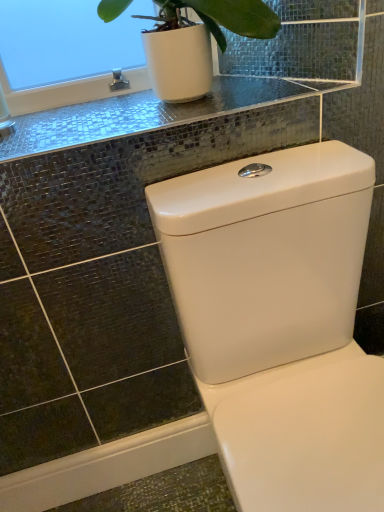
Question: From the image's perspective, would you say white glossy toilet at center is positioned over shiny glass counter top at upper center?

Choices:
 (A) no
 (B) yes

Answer: (A)

Question: Is white glossy toilet at center smaller than shiny glass counter top at upper center?

Choices:
 (A) no
 (B) yes

Answer: (A)

Question: Is white glossy toilet at center looking in the opposite direction of shiny glass counter top at upper center?

Choices:
 (A) no
 (B) yes

Answer: (B)

Question: Can you confirm if white glossy toilet at center is shorter than shiny glass counter top at upper center?

Choices:
 (A) no
 (B) yes

Answer: (A)

Question: Is white glossy toilet at center to the left of shiny glass counter top at upper center from the viewer's perspective?

Choices:
 (A) no
 (B) yes

Answer: (A)

Question: Is white glossy toilet at center to the right of shiny glass counter top at upper center from the viewer's perspective?

Choices:
 (A) no
 (B) yes

Answer: (B)

Question: Is shiny glass counter top at upper center taller than white glossy toilet at center?

Choices:
 (A) yes
 (B) no

Answer: (B)

Question: Is shiny glass counter top at upper center wider than white glossy toilet at center?

Choices:
 (A) no
 (B) yes

Answer: (A)

Question: Does shiny glass counter top at upper center appear on the right side of white glossy toilet at center?

Choices:
 (A) no
 (B) yes

Answer: (A)

Question: From the image's perspective, would you say shiny glass counter top at upper center is positioned over white glossy toilet at center?

Choices:
 (A) yes
 (B) no

Answer: (A)

Question: Considering the relative sizes of shiny glass counter top at upper center and white glossy toilet at center in the image provided, is shiny glass counter top at upper center thinner than white glossy toilet at center?

Choices:
 (A) no
 (B) yes

Answer: (B)

Question: Is shiny glass counter top at upper center facing away from white glossy toilet at center?

Choices:
 (A) no
 (B) yes

Answer: (A)

Question: In the image, is shiny glass counter top at upper center positioned in front of or behind white glossy toilet at center?

Choices:
 (A) front
 (B) behind

Answer: (B)